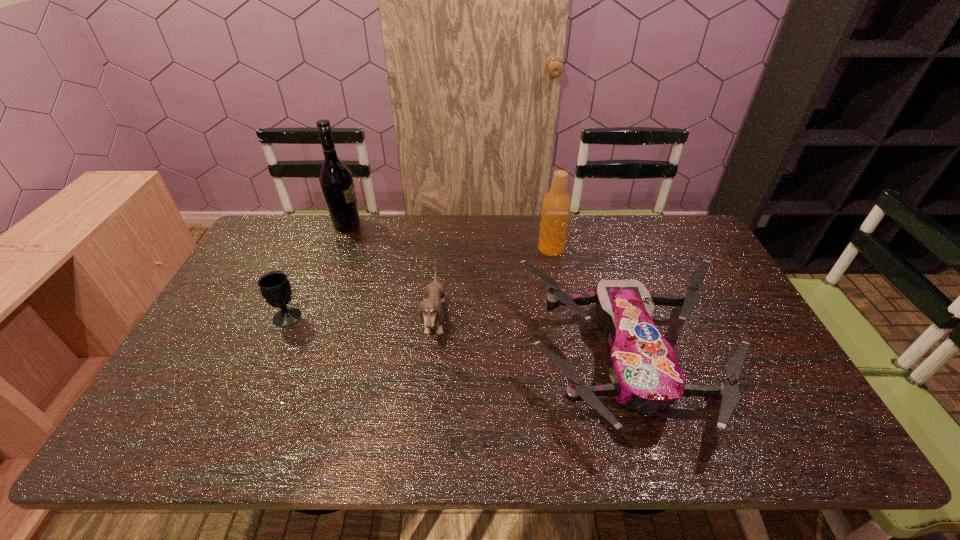
Where is `vacant point located between the chalice and the third object from right to left`? vacant point located between the chalice and the third object from right to left is located at coordinates (361, 319).

Identify which object is located as the third nearest to the chalice. Please provide its 2D coordinates. Your answer should be formatted as a tuple, i.e. [(x, y)], where the tuple contains the x and y coordinates of a point satisfying the conditions above.

[(645, 374)]

Locate which object ranks third in proximity to the third object from left to right. Please provide its 2D coordinates. Your answer should be formatted as a tuple, i.e. [(x, y)], where the tuple contains the x and y coordinates of a point satisfying the conditions above.

[(275, 287)]

Locate an element on the screen. The width and height of the screenshot is (960, 540). vacant area that satisfies the following two spatial constraints: 1. on the label of the fourth nearest object; 2. on the left side of the farthest object is located at coordinates (338, 248).

Find the location of a particular element. This screenshot has width=960, height=540. vacant space that satisfies the following two spatial constraints: 1. on the label of the fourth shortest object; 2. on the left side of the tallest object is located at coordinates (338, 248).

You are a GUI agent. You are given a task and a screenshot of the screen. Output one action in this format:
    pyautogui.click(x=<x>, y=<y>)
    Task: Click on the vacant area in the image that satisfies the following two spatial constraints: 1. on the label of the farthest object; 2. on the left side of the fourth nearest object
    This screenshot has width=960, height=540.
    Given the screenshot: What is the action you would take?
    pyautogui.click(x=338, y=248)

This screenshot has width=960, height=540. I want to click on blank space that satisfies the following two spatial constraints: 1. on the label of the farthest object; 2. on the right side of the beer bottle, so click(338, 248).